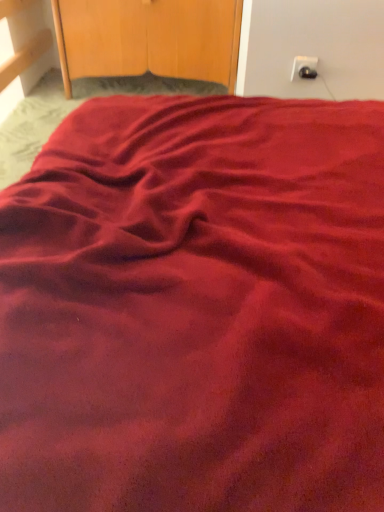
Locate an element on the screen. This screenshot has width=384, height=512. black plastic outlet at upper right is located at coordinates (304, 67).

The height and width of the screenshot is (512, 384). What do you see at coordinates (304, 67) in the screenshot?
I see `black plastic outlet at upper right` at bounding box center [304, 67].

Describe the element at coordinates (149, 38) in the screenshot. I see `wooden dresser at upper center` at that location.

This screenshot has width=384, height=512. In order to click on wooden dresser at upper center in this screenshot , I will do `click(149, 38)`.

What are the coordinates of `black plastic outlet at upper right` in the screenshot? It's located at (304, 67).

Considering the positions of objects wooden dresser at upper center and black plastic outlet at upper right in the image provided, who is more to the right, wooden dresser at upper center or black plastic outlet at upper right?

black plastic outlet at upper right is more to the right.

Relative to black plastic outlet at upper right, is wooden dresser at upper center in front or behind?

wooden dresser at upper center is behind black plastic outlet at upper right.

Considering the points (130, 14) and (314, 62), which point is behind, point (130, 14) or point (314, 62)?

The point (130, 14) is farther.

From the image's perspective, which object appears higher, wooden dresser at upper center or black plastic outlet at upper right?

wooden dresser at upper center appears higher in the image.

From a real-world perspective, which is physically above, wooden dresser at upper center or black plastic outlet at upper right?

black plastic outlet at upper right.

Between wooden dresser at upper center and black plastic outlet at upper right, which one has smaller width?

With smaller width is black plastic outlet at upper right.

Who is taller, wooden dresser at upper center or black plastic outlet at upper right?

wooden dresser at upper center is taller.

In terms of size, does wooden dresser at upper center appear bigger or smaller than black plastic outlet at upper right?

In the image, wooden dresser at upper center appears to be larger than black plastic outlet at upper right.

Is wooden dresser at upper center outside of black plastic outlet at upper right?

wooden dresser at upper center lies outside black plastic outlet at upper right's area.

Is wooden dresser at upper center far away from black plastic outlet at upper right?

No, wooden dresser at upper center is in close proximity to black plastic outlet at upper right.

Is wooden dresser at upper center oriented towards black plastic outlet at upper right?

No, wooden dresser at upper center is not aimed at black plastic outlet at upper right.

This screenshot has width=384, height=512. What are the coordinates of `dresser that appears on the left of black plastic outlet at upper right` in the screenshot? It's located at (149, 38).

Which object is positioned more to the left, black plastic outlet at upper right or wooden dresser at upper center?

wooden dresser at upper center is more to the left.

Who is more distant, black plastic outlet at upper right or wooden dresser at upper center?

wooden dresser at upper center is further from the camera.

Considering the positions of point (299, 58) and point (114, 73), is point (299, 58) closer or farther from the camera than point (114, 73)?

Point (299, 58) appears to be closer to the viewer than point (114, 73).

From the image's perspective, between black plastic outlet at upper right and wooden dresser at upper center, which one is located above?

wooden dresser at upper center.

From a real-world perspective, which is physically above, black plastic outlet at upper right or wooden dresser at upper center?

From a 3D spatial view, black plastic outlet at upper right is above.

Does black plastic outlet at upper right have a lesser width compared to wooden dresser at upper center?

Correct, the width of black plastic outlet at upper right is less than that of wooden dresser at upper center.

Is black plastic outlet at upper right shorter than wooden dresser at upper center?

Correct, black plastic outlet at upper right is not as tall as wooden dresser at upper center.

Is black plastic outlet at upper right smaller than wooden dresser at upper center?

Indeed, black plastic outlet at upper right has a smaller size compared to wooden dresser at upper center.

Does black plastic outlet at upper right contain wooden dresser at upper center?

No, wooden dresser at upper center is not surrounded by black plastic outlet at upper right.

Is black plastic outlet at upper right next to wooden dresser at upper center and touching it?

There is a gap between black plastic outlet at upper right and wooden dresser at upper center.

Is black plastic outlet at upper right turned away from wooden dresser at upper center?

No.

How many degrees apart are the facing directions of black plastic outlet at upper right and wooden dresser at upper center?

They differ by 0.00614 degrees in their facing directions.

How distant is black plastic outlet at upper right from wooden dresser at upper center?

They are 24.53 inches apart.

This screenshot has height=512, width=384. Identify the location of dresser above the black plastic outlet at upper right (from the image's perspective). (149, 38).

You are a GUI agent. You are given a task and a screenshot of the screen. Output one action in this format:
    pyautogui.click(x=<x>, y=<y>)
    Task: Click on the dresser lying above the black plastic outlet at upper right (from the image's perspective)
    The image size is (384, 512).
    Given the screenshot: What is the action you would take?
    pyautogui.click(x=149, y=38)

This screenshot has width=384, height=512. I want to click on dresser on the left of the black plastic outlet at upper right, so click(149, 38).